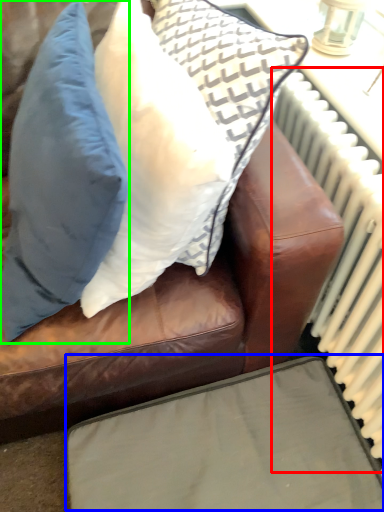
Question: Based on their relative distances, which object is nearer to radiator (highlighted by a red box)? Choose from furniture (highlighted by a blue box) and pillow (highlighted by a green box).

Choices:
 (A) furniture
 (B) pillow

Answer: (A)